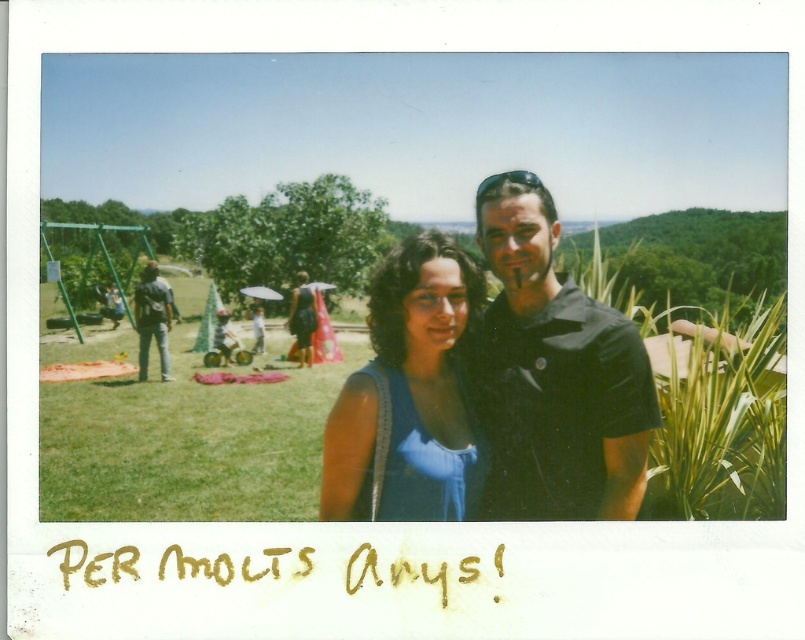
Consider the image. You are a photographer standing 1.5 meters tall. You want to take a photo of the blue satin dress at center without bending down or leaning back. Can you do it while standing upright?

The blue satin dress at center and camera are 2.84 meters apart from each other. Since the photographer is 1.5 meters tall and the distance is greater than their height, they can stand upright and take the photo without needing to bend or lean.

Based on the photo, you are standing in the park and want to take a photo of both the point at coordinates (x=611, y=241) and the point at coordinates (x=533, y=348). Which point should you focus on first to ensure both are in focus?

You should focus on the point at coordinates (x=611, y=241) first because it is closer to you than the point at coordinates (x=533, y=348). This way, both points will be in focus when using a camera with a shallow depth of field.

You are a photographer trying to capture a group photo of the two people wearing the matte blue dress at center and the black matte shirt at center. If your camera has a maximum focus range of 4 meters, will you be able to get both subjects in focus at the same time?

The matte blue dress at center and black matte shirt at center are 3.73 meters apart from each other. Since the distance between them is within the camera maximum focus range of 4 meters, both subjects can be in focus simultaneously.